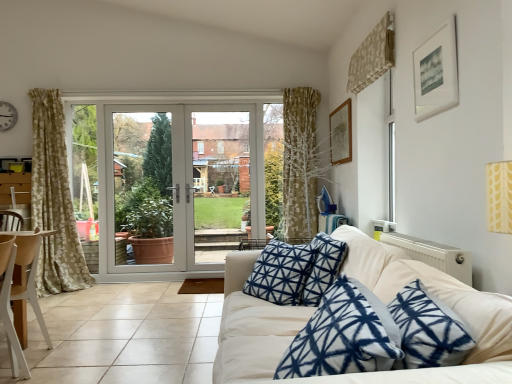
Identify the location of free spot behind wooden chair at left. The width and height of the screenshot is (512, 384). click(x=65, y=338).